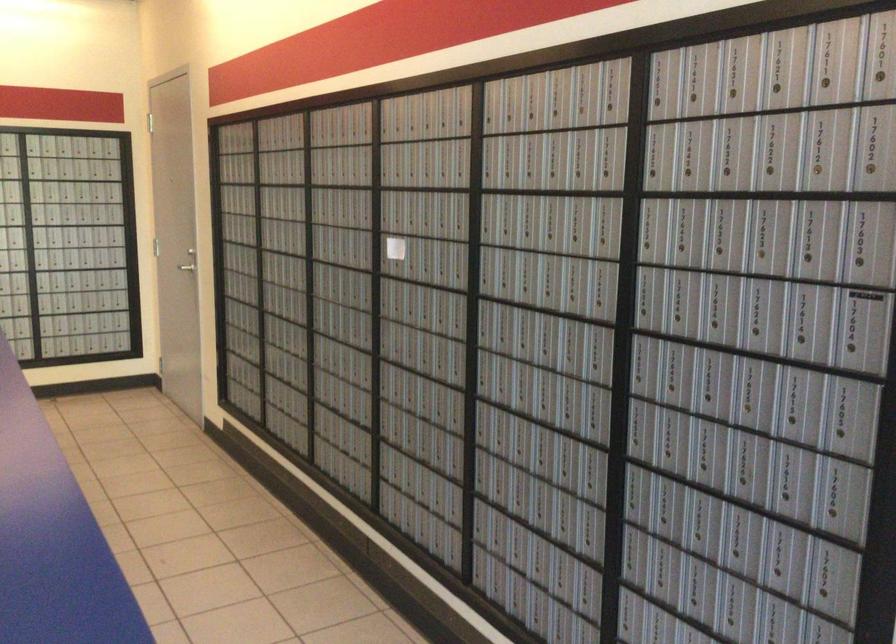
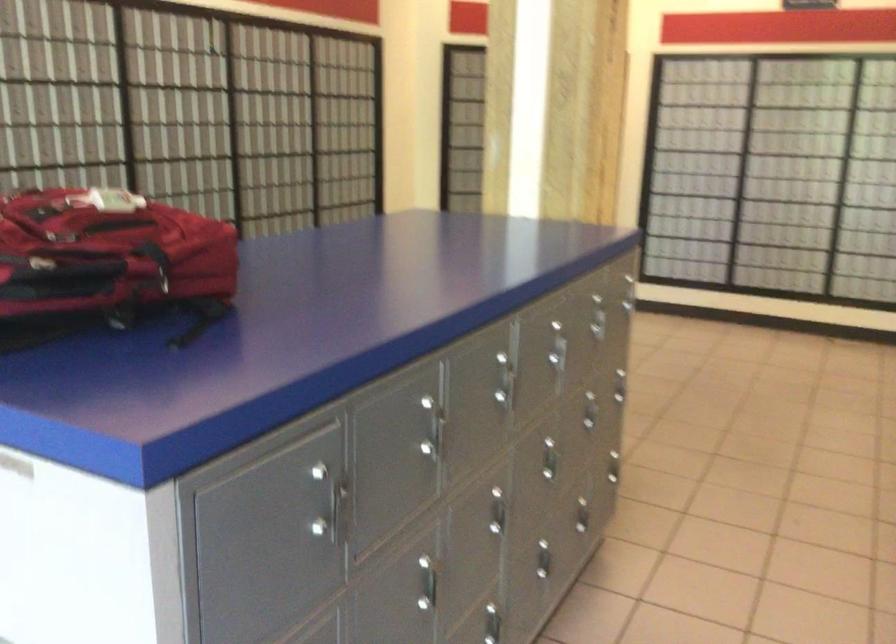
Question: How did the camera likely rotate?

Choices:
 (A) Left
 (B) Right
 (C) Up
 (D) Down

Answer: (A)